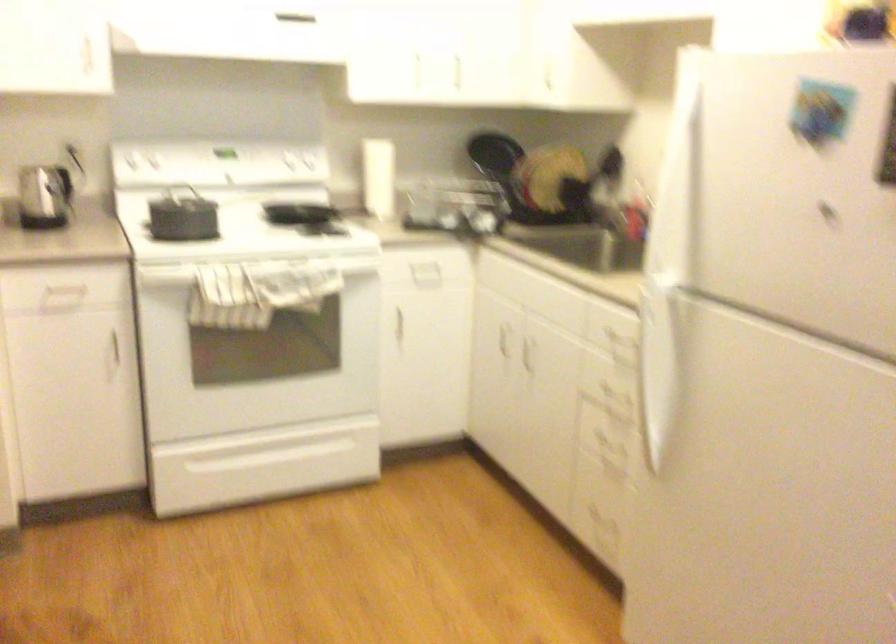
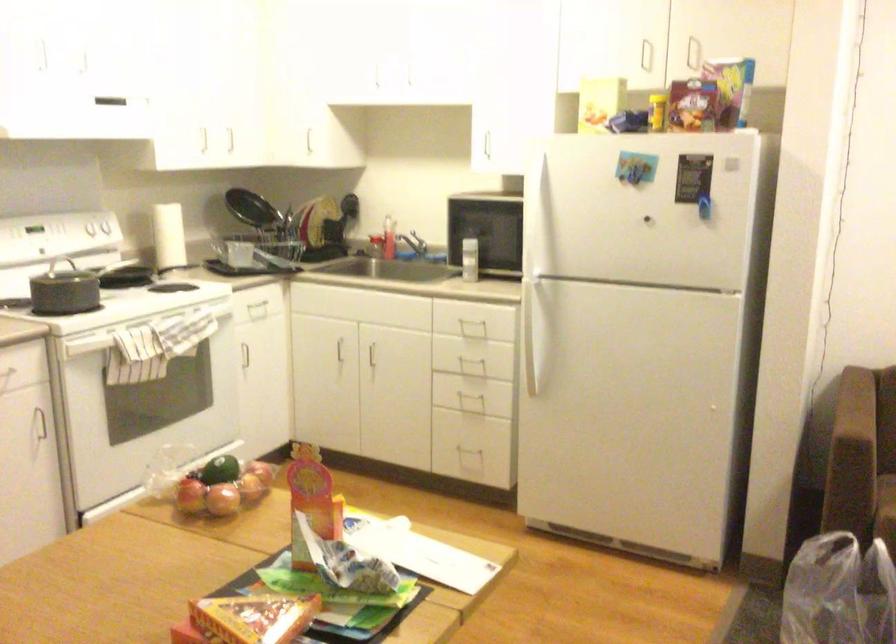
Where in the second image is the point corresponding to point 350,172 from the first image?

(168, 236)